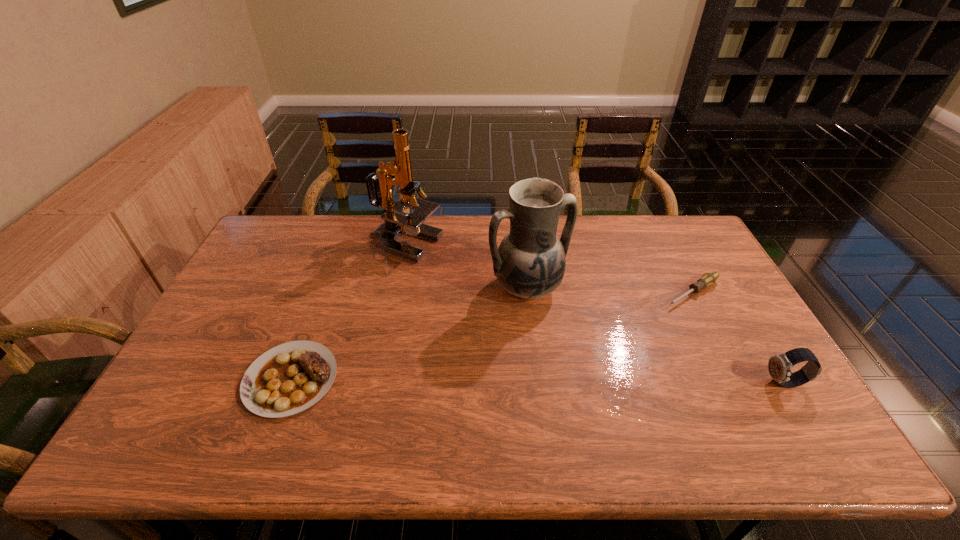
Locate an element on the screen. steak present at the near edge is located at coordinates pos(289,378).

The image size is (960, 540). I want to click on watch at the near edge, so click(x=779, y=366).

Image resolution: width=960 pixels, height=540 pixels. Identify the location of watch that is at the right edge. (779, 366).

This screenshot has width=960, height=540. Identify the location of screwdriver located in the right edge section of the desktop. tap(707, 279).

What are the coordinates of `object that is at the near right corner` in the screenshot? It's located at coord(779,366).

At what (x,y) coordinates should I click in order to perform the action: click on free space at the far edge. Please return your answer as a coordinate pair (x, y). Looking at the image, I should click on (458, 227).

Where is `vacant area at the near edge`? Image resolution: width=960 pixels, height=540 pixels. vacant area at the near edge is located at coordinates (691, 403).

Locate an element on the screen. This screenshot has width=960, height=540. free space at the left edge of the desktop is located at coordinates (271, 256).

In the image, there is a desktop. Identify the location of vacant space at the right edge. (747, 368).

The image size is (960, 540). Find the location of `free spot at the far left corner of the desktop`. free spot at the far left corner of the desktop is located at coordinates [305, 219].